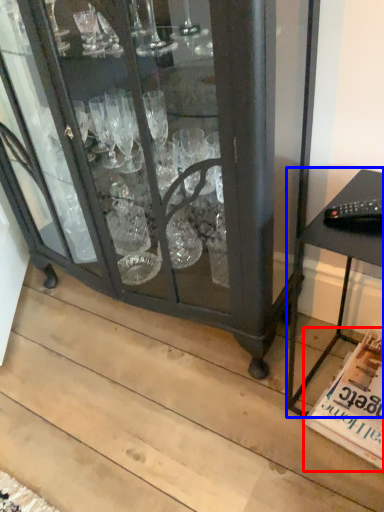
Question: Which object is closer to the camera taking this photo, magazine (highlighted by a red box) or table (highlighted by a blue box)?

Choices:
 (A) magazine
 (B) table

Answer: (B)